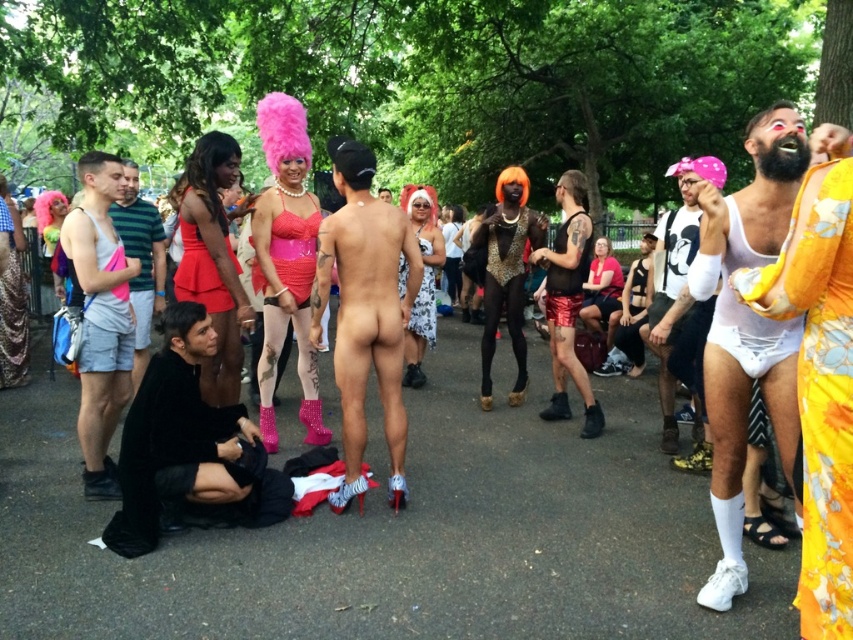
You are a photographer at the festival and want to capture both the matte gray tank top at left and the shiny red dress at center in a single shot. Based on their positions, which one would appear lower in the photo?

The matte gray tank top at left appears lower in the photo because it is located below the shiny red dress at center.

You are a photographer at the event and want to capture both the smooth skin torso at center and the shiny red dress at center in a single frame. Which object should you focus on first to ensure both are in the frame?

The smooth skin torso at center has a larger size compared to the shiny red dress at center, so you should focus on the smooth skin torso at center first to ensure both are in the frame.

You are a photographer at the festival and want to take a photo that focuses on both the smooth skin torso at center and the shiny red dress at center. Since you can only focus on one subject at a time, which one should you choose to ensure the other is still somewhat in focus?

You should focus on the smooth skin torso at center because it is closer to the viewer. By focusing on the closer subject, the shiny red dress at center, which is farther away, will still be somewhat in focus due to the depth of field.